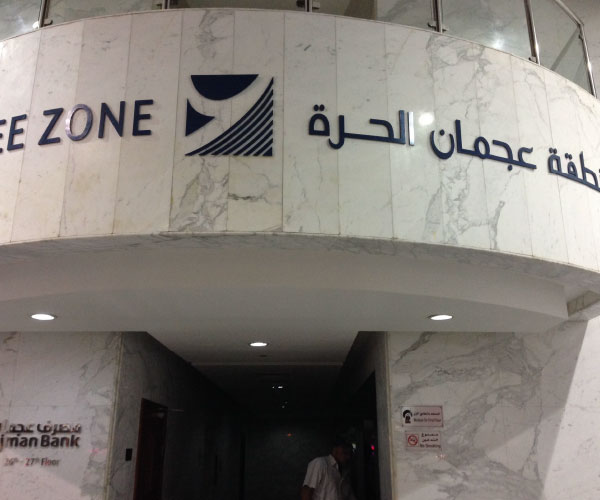
Where is `signs to right of hall`? The width and height of the screenshot is (600, 500). signs to right of hall is located at coordinates (433, 446), (424, 410).